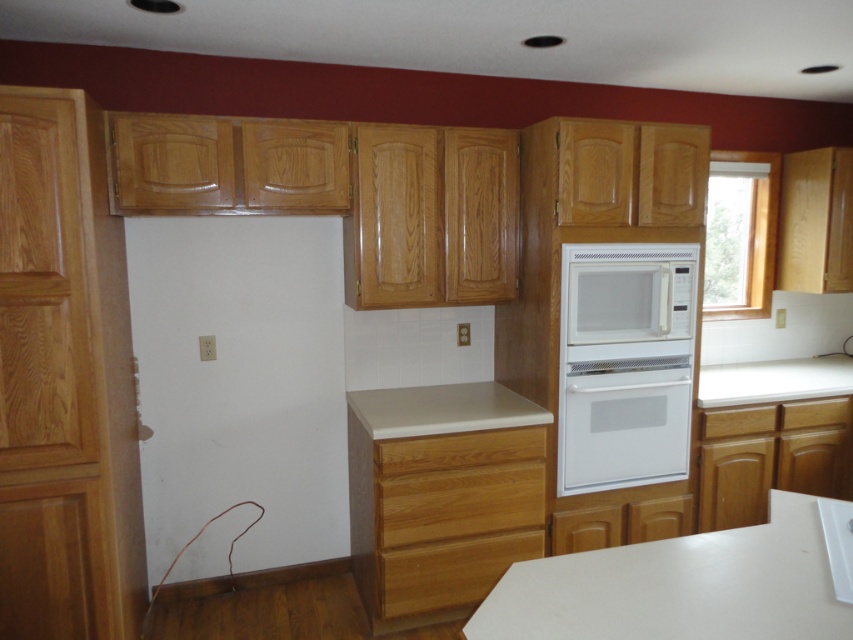
You are organizing your kitchen and need to place a tall spice jar. You have two wooden drawers available in the lower section of the cabinets. The wooden drawer at lower center and the wooden drawer at lower right. Which drawer should you choose to store the tall spice jar?

The wooden drawer at lower center has a greater height compared to the wooden drawer at lower right, so you should choose the wooden drawer at lower center to store the tall spice jar.

You are organizing the kitchen and need to place a large baking dish that requires 0.5 cubic feet of space. You have the white matte microwave at center and the wooden drawer at center available. Which one can accommodate the baking dish?

The white matte microwave at center has a larger size compared to wooden drawer at center, so it can accommodate the baking dish requiring 0.5 cubic feet of space.